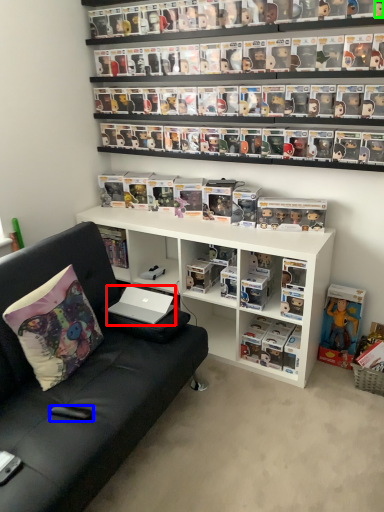
Question: Which object is the closest to the laptop (highlighted by a red box)? Choose among these: remote control (highlighted by a blue box) or toy (highlighted by a green box).

Choices:
 (A) remote control
 (B) toy

Answer: (A)